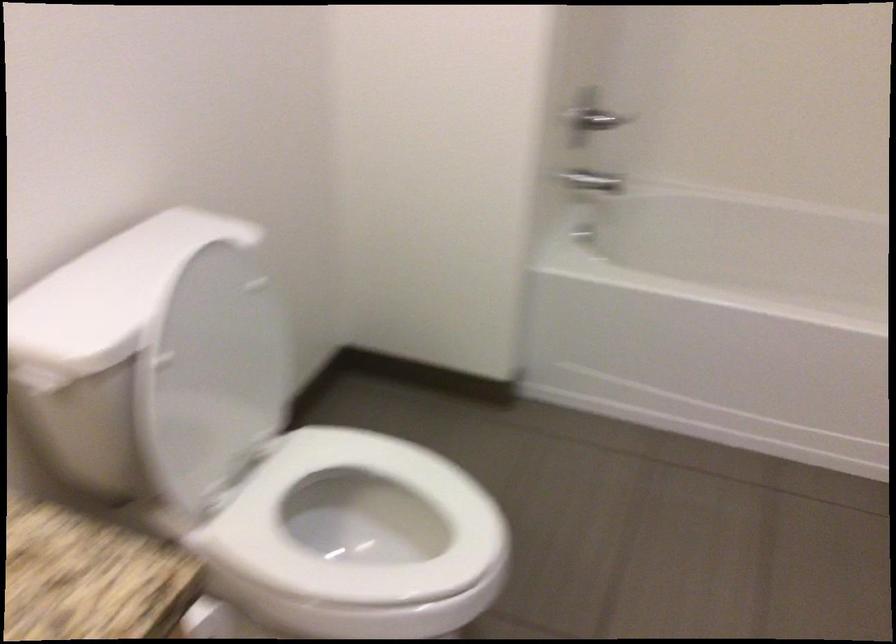
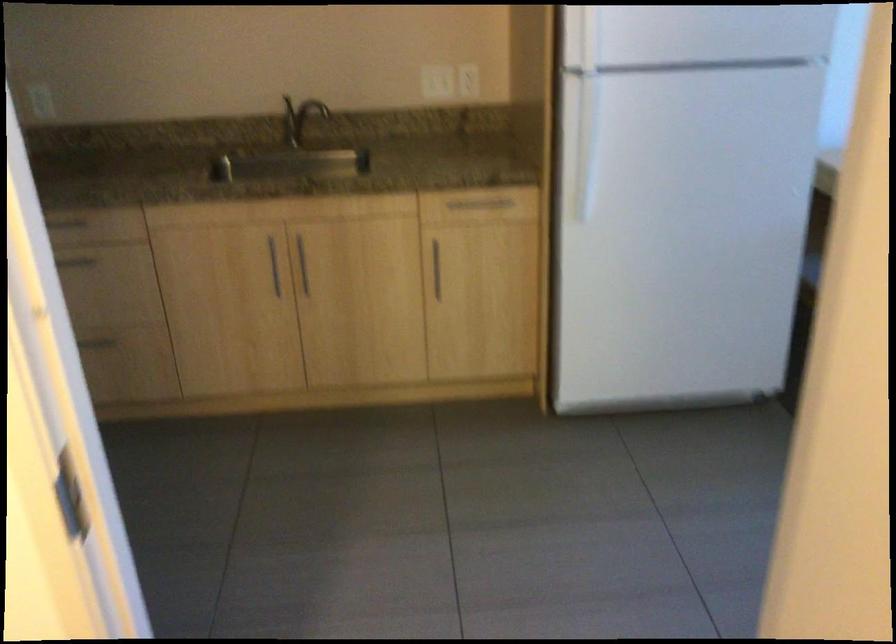
In the scene shown: First-person continuous shooting, in which direction is the camera rotating?

The camera rotated toward right-down.